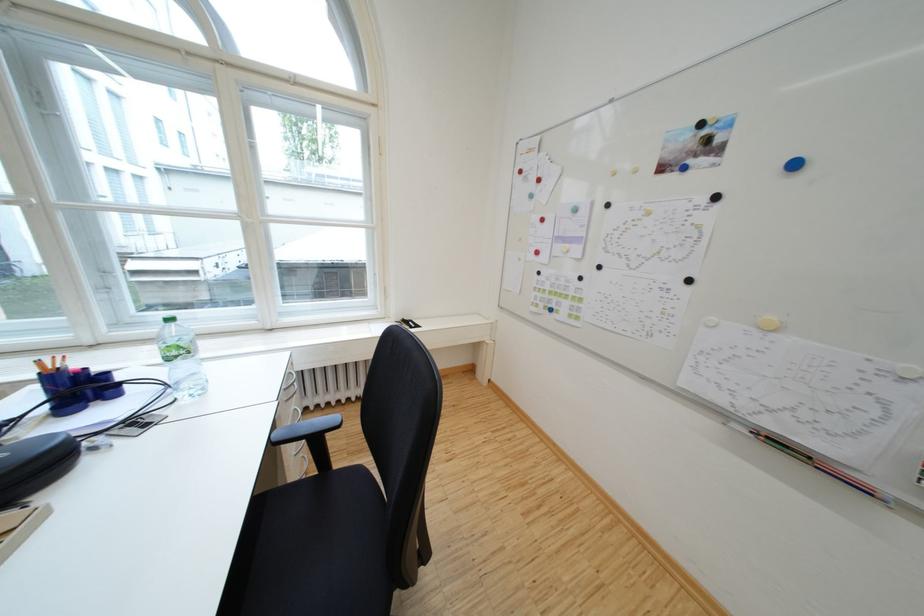
The height and width of the screenshot is (616, 924). In order to click on white window handle in this screenshot , I will do `click(15, 200)`.